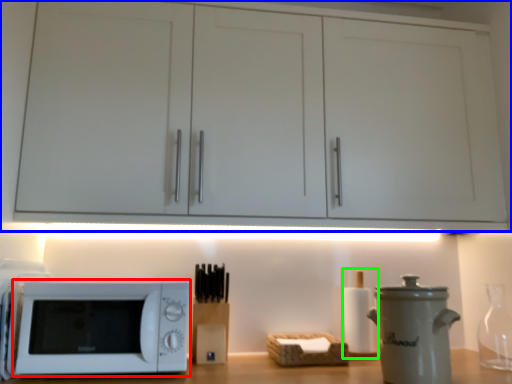
Question: Which is farther away from microwave oven (highlighted by a red box)? cabinetry (highlighted by a blue box) or bottle (highlighted by a green box)?

Choices:
 (A) cabinetry
 (B) bottle

Answer: (B)